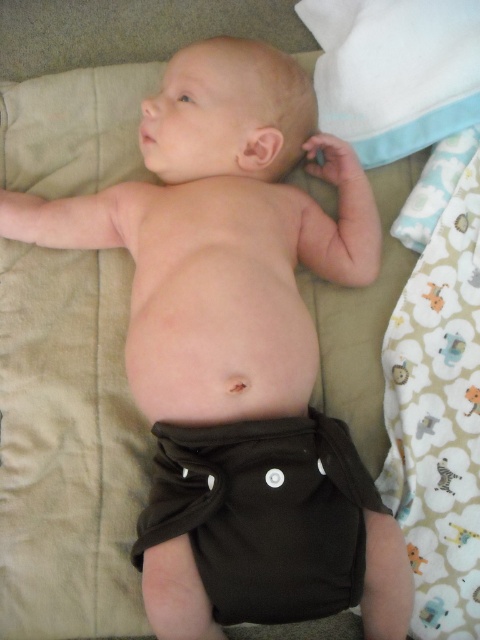
Question: Which of the following is the farthest from the observer?

Choices:
 (A) (456, 296)
 (B) (367, 474)

Answer: (A)

Question: Which point is farther to the camera?

Choices:
 (A) white fabric at lower right
 (B) brown fabric diaper at center

Answer: (A)

Question: Is brown fabric diaper at center thinner than white fabric at lower right?

Choices:
 (A) yes
 (B) no

Answer: (B)

Question: Can you confirm if brown fabric diaper at center is positioned above white fabric at lower right?

Choices:
 (A) yes
 (B) no

Answer: (B)

Question: Observing the image, what is the correct spatial positioning of brown fabric diaper at center in reference to white fabric at lower right?

Choices:
 (A) above
 (B) below

Answer: (B)